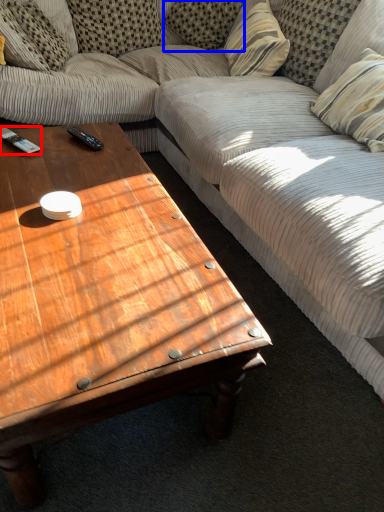
Question: Which object appears closest to the camera in this image, remote control (highlighted by a red box) or pillow (highlighted by a blue box)?

Choices:
 (A) remote control
 (B) pillow

Answer: (A)